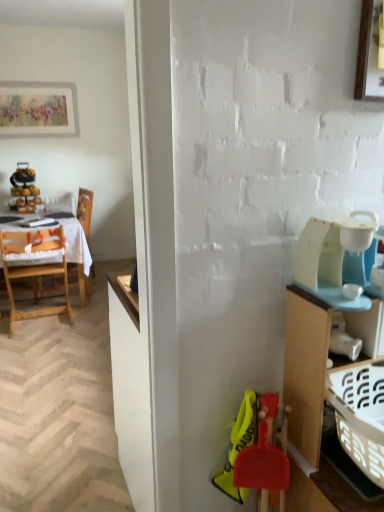
Question: From the image's perspective, does wooden chair at left, positioned as the first chair in back-to-front order, appear higher than white plastic coffee maker at right?

Choices:
 (A) no
 (B) yes

Answer: (B)

Question: Does wooden chair at left, which is the second chair in front-to-back order, appear on the right side of white plastic coffee maker at right?

Choices:
 (A) yes
 (B) no

Answer: (B)

Question: Does wooden chair at left, which is the second chair in front-to-back order, lie behind white plastic coffee maker at right?

Choices:
 (A) no
 (B) yes

Answer: (B)

Question: Is the surface of wooden chair at left, positioned as the first chair in back-to-front order, in direct contact with white plastic coffee maker at right?

Choices:
 (A) no
 (B) yes

Answer: (A)

Question: Considering the relative sizes of wooden chair at left, positioned as the first chair in back-to-front order, and white plastic coffee maker at right in the image provided, is wooden chair at left, positioned as the first chair in back-to-front order, smaller than white plastic coffee maker at right?

Choices:
 (A) yes
 (B) no

Answer: (B)

Question: Is wooden chair at left, positioned as the first chair in back-to-front order, inside or outside of white plastic coffee maker at right?

Choices:
 (A) outside
 (B) inside

Answer: (A)

Question: From a real-world perspective, is wooden chair at left, positioned as the first chair in back-to-front order, above or below white plastic coffee maker at right?

Choices:
 (A) above
 (B) below

Answer: (B)

Question: From the image's perspective, relative to white plastic coffee maker at right, is wooden chair at left, which is the second chair in front-to-back order, above or below?

Choices:
 (A) above
 (B) below

Answer: (A)

Question: Is wooden chair at left, positioned as the first chair in back-to-front order, bigger or smaller than white plastic coffee maker at right?

Choices:
 (A) small
 (B) big

Answer: (B)

Question: In the image, is white cloth at left positioned in front of or behind wooden cabinet at right?

Choices:
 (A) behind
 (B) front

Answer: (A)

Question: Is white cloth at left taller or shorter than wooden cabinet at right?

Choices:
 (A) tall
 (B) short

Answer: (B)

Question: From the image's perspective, relative to wooden cabinet at right, is white cloth at left above or below?

Choices:
 (A) above
 (B) below

Answer: (A)

Question: Does point (84, 245) appear closer or farther from the camera than point (327, 386)?

Choices:
 (A) closer
 (B) farther

Answer: (B)

Question: Would you say wooden cabinet at right is to the left or to the right of matte white picture frame at upper left, the 2th picture frame positioned from the bottom, in the picture?

Choices:
 (A) right
 (B) left

Answer: (A)

Question: In terms of width, does wooden cabinet at right look wider or thinner when compared to matte white picture frame at upper left, arranged as the second picture frame when viewed from the front?

Choices:
 (A) thin
 (B) wide

Answer: (B)